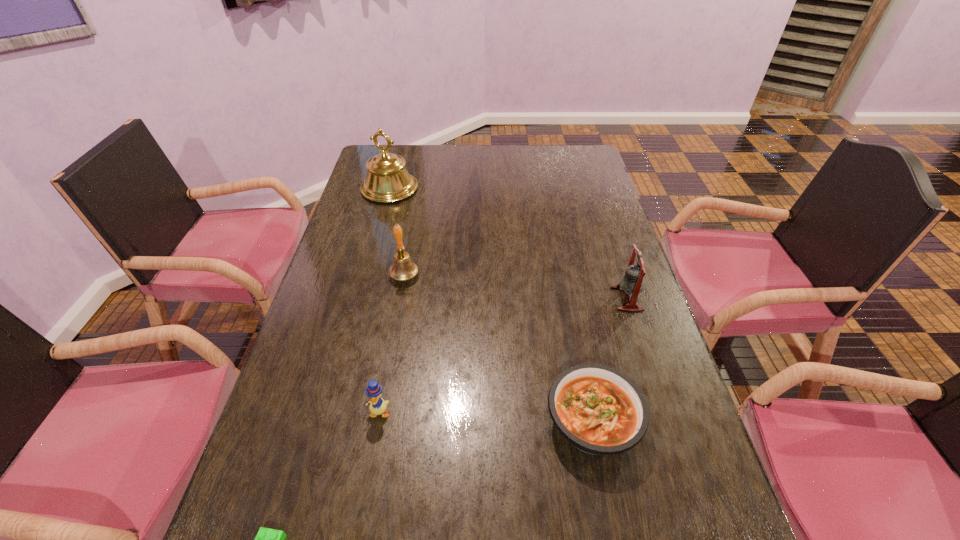
Find the location of `the tallest object`. the tallest object is located at coordinates (387, 180).

The width and height of the screenshot is (960, 540). I want to click on the farthest object, so click(387, 180).

Identify the location of the rightmost object. (632, 283).

Find the location of `the fourth tallest object`. the fourth tallest object is located at coordinates (377, 406).

Find the location of `stew`. stew is located at coordinates (599, 410).

In order to click on the second shortest object in this screenshot , I will do `click(599, 410)`.

This screenshot has width=960, height=540. I want to click on free space located on the right of the farthest object, so click(498, 189).

The image size is (960, 540). I want to click on vacant space located 0.150m on the left of the rightmost bell, so click(x=559, y=299).

Identify the location of vacant area located 0.100m on the face of the third shortest object, where the monocle is placed. (369, 467).

Image resolution: width=960 pixels, height=540 pixels. In order to click on free space located 0.210m on the back of the second object from right to left in this screenshot , I will do `click(571, 313)`.